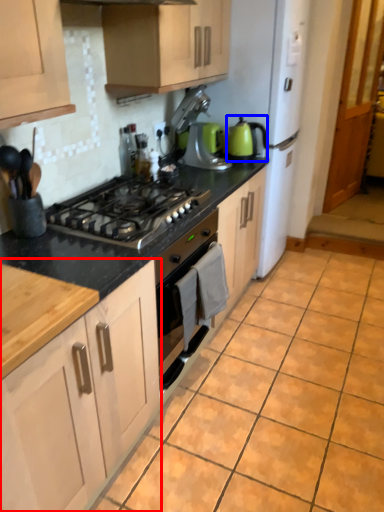
Question: Which of the following is the closest to the observer, cabinetry (highlighted by a red box) or tea pot (highlighted by a blue box)?

Choices:
 (A) cabinetry
 (B) tea pot

Answer: (A)